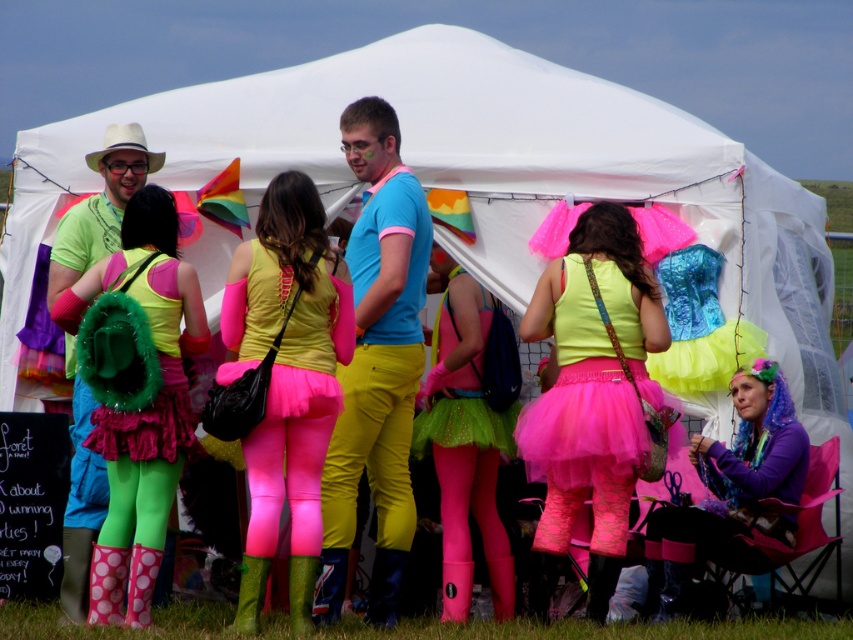
Who is lower down, pink tulle skirt at center or purple matte tights at lower right?

purple matte tights at lower right is lower down.

What do you see at coordinates (595, 390) in the screenshot? I see `pink tulle skirt at center` at bounding box center [595, 390].

Find the location of a particular element. pink tulle skirt at center is located at coordinates (595, 390).

Who is positioned more to the left, matte blue shirt at center or fuzzy green backpack at left?

fuzzy green backpack at left is more to the left.

Between matte blue shirt at center and fuzzy green backpack at left, which one is positioned lower?

fuzzy green backpack at left is below.

What do you see at coordinates (376, 365) in the screenshot? I see `matte blue shirt at center` at bounding box center [376, 365].

At what (x,y) coordinates should I click in order to perform the action: click on matte blue shirt at center. Please return your answer as a coordinate pair (x, y). Looking at the image, I should click on (376, 365).

Does neon green tulle skirt at center have a smaller size compared to white fabric cowboy hat at upper left?

Incorrect, neon green tulle skirt at center is not smaller in size than white fabric cowboy hat at upper left.

Which is more to the right, neon green tulle skirt at center or white fabric cowboy hat at upper left?

neon green tulle skirt at center is more to the right.

This screenshot has width=853, height=640. Find the location of `neon green tulle skirt at center`. neon green tulle skirt at center is located at coordinates (465, 442).

Locate an element on the screen. This screenshot has width=853, height=640. neon green tulle skirt at center is located at coordinates (465, 442).